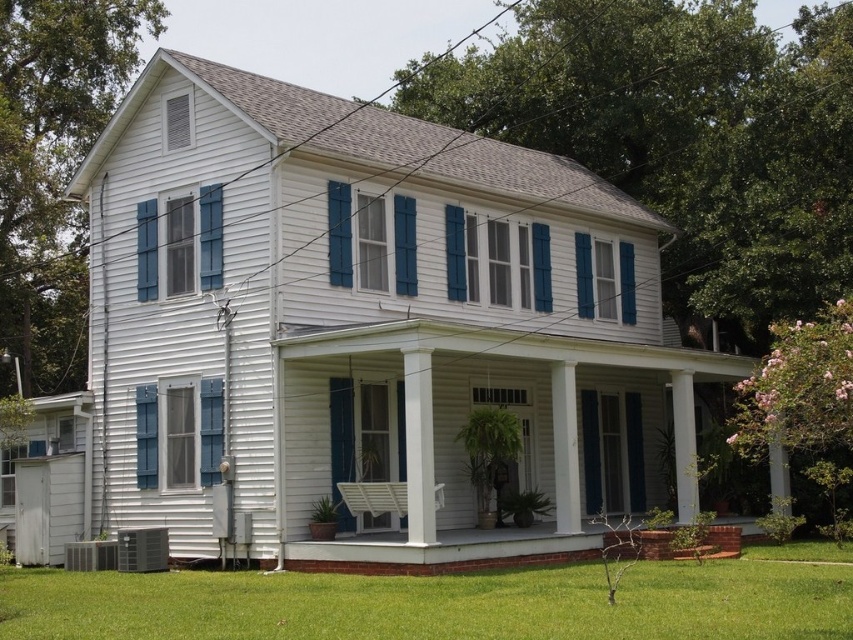
Image resolution: width=853 pixels, height=640 pixels. What do you see at coordinates (480, 406) in the screenshot? I see `white wood porch at center` at bounding box center [480, 406].

Does white wood porch at center appear under green grass at lower center?

Incorrect, white wood porch at center is not positioned below green grass at lower center.

Image resolution: width=853 pixels, height=640 pixels. I want to click on white wood porch at center, so click(x=480, y=406).

Who is taller, green grass at lower center or white wood porch at lower center?

Standing taller between the two is green grass at lower center.

Can you confirm if green grass at lower center is wider than white wood porch at lower center?

Yes.

Who is more forward, (737, 620) or (570, 540)?

Point (737, 620) is in front.

Image resolution: width=853 pixels, height=640 pixels. Identify the location of green grass at lower center. (436, 604).

Between white wood porch at center and white wood porch at lower center, which one appears on the right side from the viewer's perspective?

white wood porch at center

Does white wood porch at center have a greater height compared to white wood porch at lower center?

Indeed, white wood porch at center has a greater height compared to white wood porch at lower center.

At what (x,y) coordinates should I click in order to perform the action: click on white wood porch at center. Please return your answer as a coordinate pair (x, y). The height and width of the screenshot is (640, 853). Looking at the image, I should click on (480, 406).

This screenshot has width=853, height=640. What are the coordinates of `white wood porch at center` in the screenshot? It's located at (480, 406).